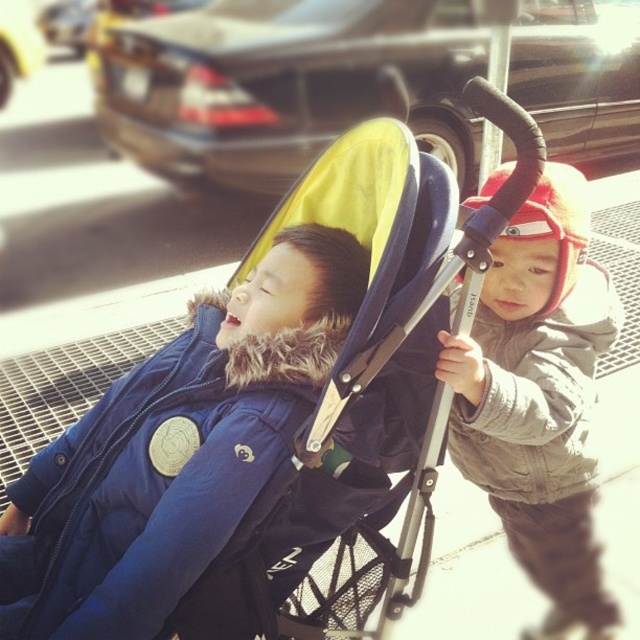
Can you confirm if blue down jacket at left is positioned to the right of gray fleece jacket at upper right?

No, blue down jacket at left is not to the right of gray fleece jacket at upper right.

Between point (275, 440) and point (499, 483), which one is positioned behind?

Point (499, 483)

The width and height of the screenshot is (640, 640). In order to click on blue down jacket at left in this screenshot , I will do `click(164, 474)`.

Can you confirm if yellow fabric baby carriage at center is bigger than blue down jacket at left?

Correct, yellow fabric baby carriage at center is larger in size than blue down jacket at left.

Is yellow fabric baby carriage at center below blue down jacket at left?

Actually, yellow fabric baby carriage at center is above blue down jacket at left.

Find the location of a particular element. yellow fabric baby carriage at center is located at coordinates (256, 406).

From the picture: Between yellow fabric baby carriage at center and gray fleece jacket at right, which one is positioned lower?

gray fleece jacket at right

Can you confirm if yellow fabric baby carriage at center is positioned above gray fleece jacket at right?

Indeed, yellow fabric baby carriage at center is positioned over gray fleece jacket at right.

Is point (339, 184) less distant than point (568, 620)?

Yes, point (339, 184) is in front of point (568, 620).

Image resolution: width=640 pixels, height=640 pixels. Find the location of `yellow fabric baby carriage at center`. yellow fabric baby carriage at center is located at coordinates click(x=256, y=406).